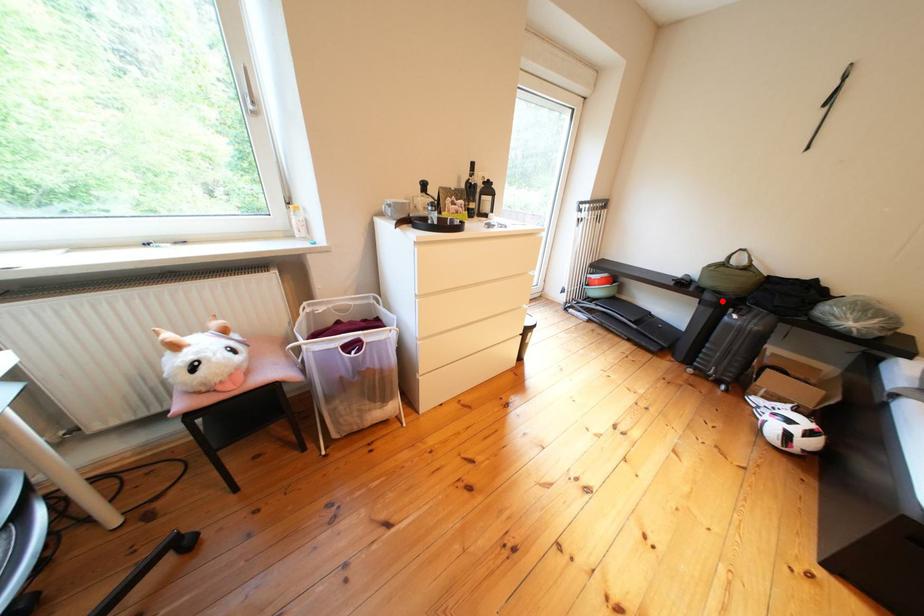
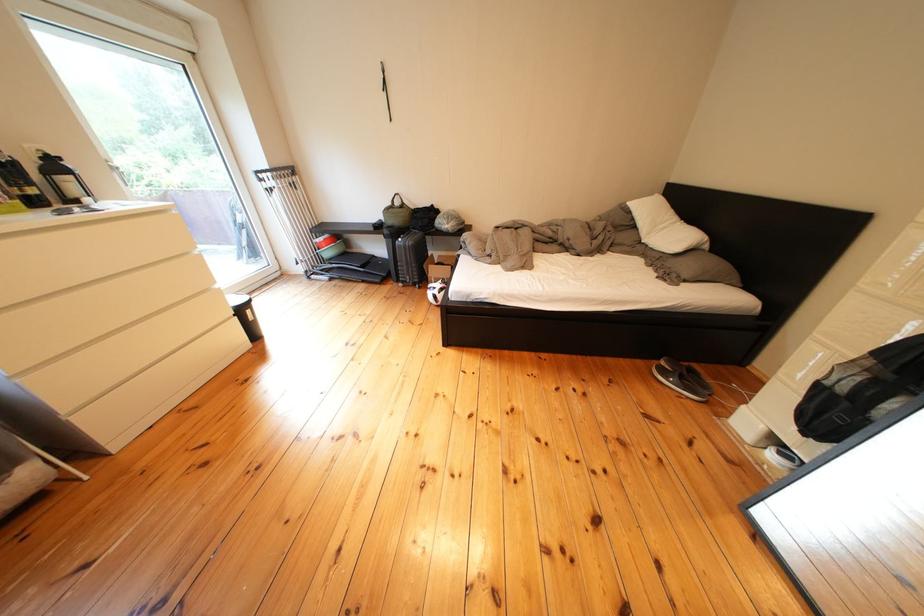
Question: I am providing you with two images of the same scene from different viewpoints. Image1 has a red point marked. In image2, the corresponding 3D location appears at what relative position? Reply with the corresponding letter.

Choices:
 (A) Closer
 (B) Farther

Answer: (A)